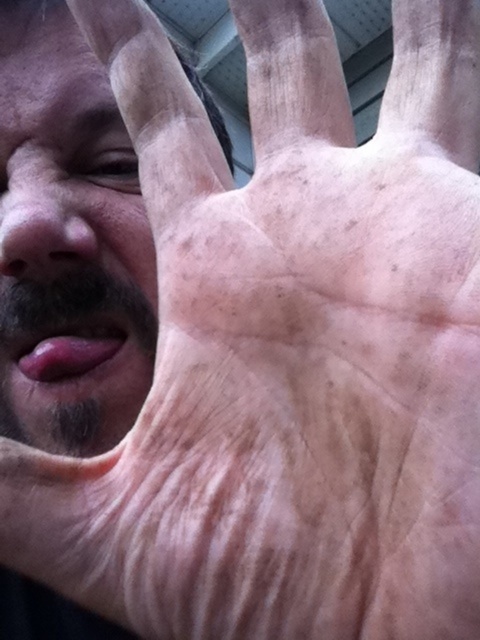
Who is more forward, (205, 100) or (17, 244)?

Point (17, 244) is in front.

Measure the distance between smooth skin at left and camera.

The distance of smooth skin at left from camera is 9.55 inches.

Does point (73, 124) lie behind point (96, 244)?

Yes, point (73, 124) is farther from viewer.

I want to click on smooth skin at left, so click(x=68, y=243).